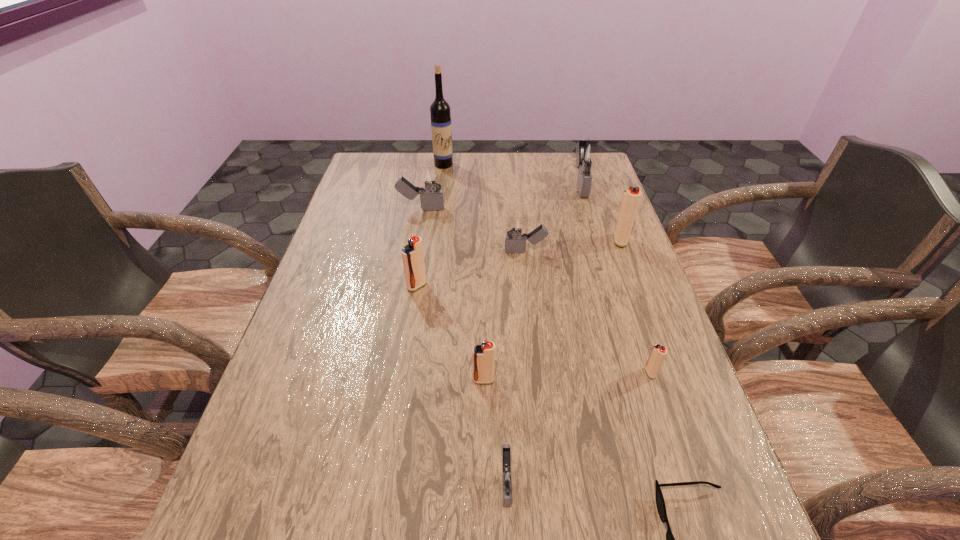
In the image, there is a desktop. Where is `vacant area at the far left corner`? The width and height of the screenshot is (960, 540). vacant area at the far left corner is located at coordinates (389, 165).

I want to click on free space between the nearest gray igniter and the third red igniter from right to left, so click(x=494, y=431).

Where is `unoccupied position between the third smallest gray igniter and the second smallest red igniter`? The width and height of the screenshot is (960, 540). unoccupied position between the third smallest gray igniter and the second smallest red igniter is located at coordinates click(452, 294).

In order to click on free space between the third red igniter from right to left and the sixth farthest object in this screenshot , I will do `click(450, 333)`.

Identify the location of free space between the third red igniter from right to left and the third smallest gray igniter. This screenshot has width=960, height=540. (452, 294).

This screenshot has width=960, height=540. I want to click on free space between the second red igniter from right to left and the rightmost gray igniter, so click(615, 279).

Where is `vacant space that is in between the nearest igniter and the rightmost gray igniter`? The image size is (960, 540). vacant space that is in between the nearest igniter and the rightmost gray igniter is located at coordinates (543, 333).

Locate an element on the screen. The height and width of the screenshot is (540, 960). unoccupied position between the rightmost red igniter and the second smallest red igniter is located at coordinates (552, 310).

Image resolution: width=960 pixels, height=540 pixels. Find the location of `object that is the eighth closest to the nearest gray igniter`. object that is the eighth closest to the nearest gray igniter is located at coordinates (588, 154).

Find the location of a particular element. object that is the eighth closest to the third biggest red igniter is located at coordinates (588, 154).